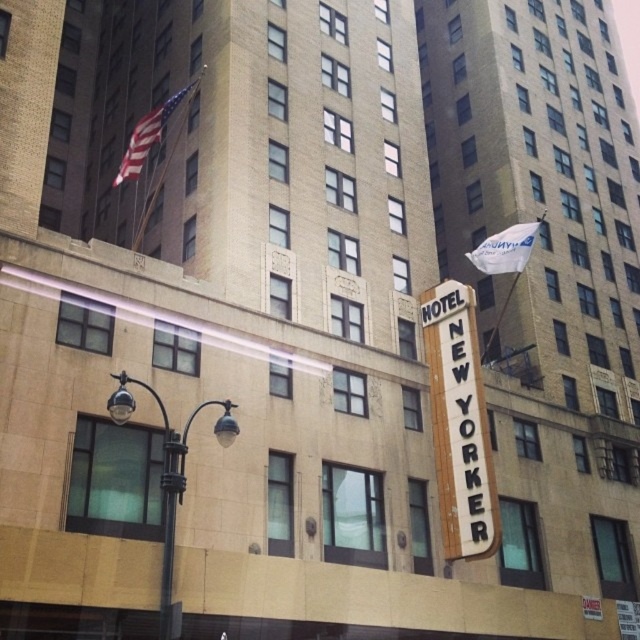
Question: Can you confirm if black metal/texture lamp post at lower left is positioned below black metal pole at lower left?

Choices:
 (A) no
 (B) yes

Answer: (A)

Question: Can you confirm if black metal pole at lower left is smaller than white fabric flag at upper right?

Choices:
 (A) yes
 (B) no

Answer: (A)

Question: Which point is closer to the camera?

Choices:
 (A) white fabric flag at upper right
 (B) american flag at upper left

Answer: (B)

Question: Which point is closer to the camera?

Choices:
 (A) white fabric flag at upper right
 (B) american flag at upper left
 (C) white/black sign at center
 (D) black metal/texture lamp post at lower left

Answer: (D)

Question: Can you confirm if white/black sign at center is smaller than black metal pole at lower left?

Choices:
 (A) no
 (B) yes

Answer: (A)

Question: Which point is farther to the camera?

Choices:
 (A) black metal/texture lamp post at lower left
 (B) american flag at upper left
 (C) white fabric flag at upper right
 (D) black metal pole at lower left

Answer: (C)